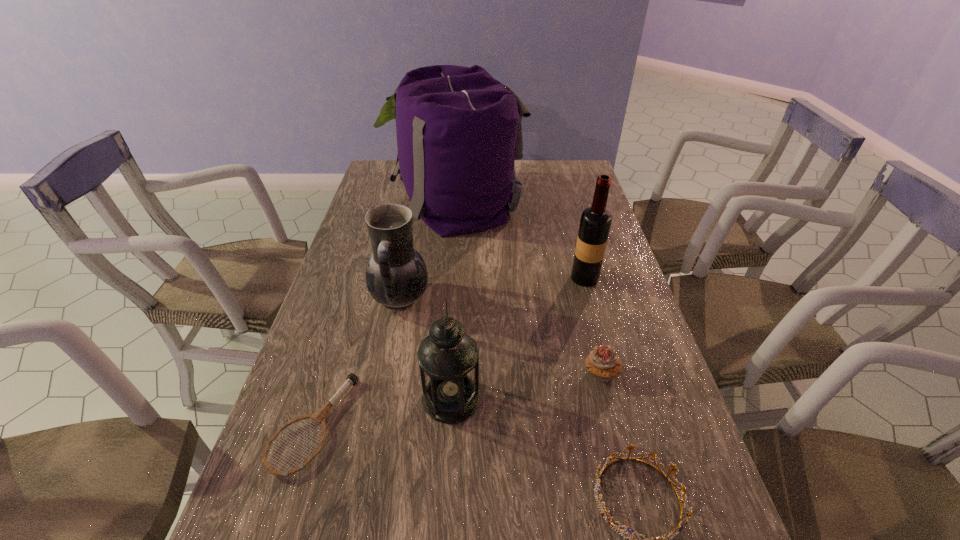
This screenshot has width=960, height=540. In order to click on vacant space located 0.160m on the front-facing side of the pitcher in this screenshot , I will do `click(486, 298)`.

This screenshot has width=960, height=540. I want to click on free location located on the front of the cupcake, so click(620, 449).

Locate an element on the screen. The height and width of the screenshot is (540, 960). free space located on the back of the tennis racket is located at coordinates (338, 346).

Where is `object that is at the far edge`? This screenshot has height=540, width=960. object that is at the far edge is located at coordinates (459, 131).

Find the location of `backpack present at the left edge`. backpack present at the left edge is located at coordinates (459, 131).

Where is `pitcher present at the left edge`? pitcher present at the left edge is located at coordinates (396, 275).

The image size is (960, 540). In order to click on tennis racket present at the left edge in this screenshot , I will do `click(319, 417)`.

Find the location of `wine bottle positioned at the right edge`. wine bottle positioned at the right edge is located at coordinates (595, 223).

Locate an element on the screen. This screenshot has width=960, height=540. cupcake that is at the right edge is located at coordinates (602, 363).

Locate an element on the screen. The height and width of the screenshot is (540, 960). object at the far left corner is located at coordinates (459, 131).